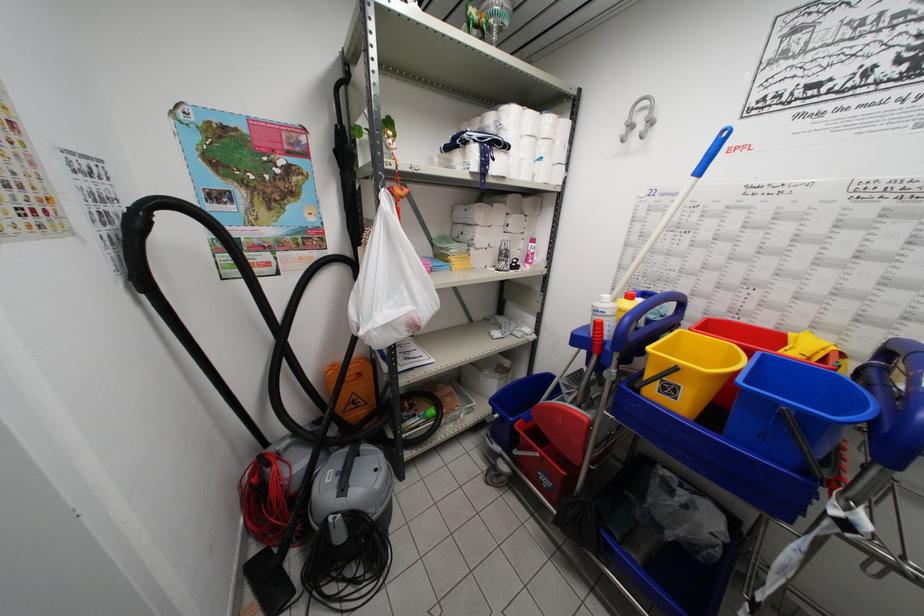
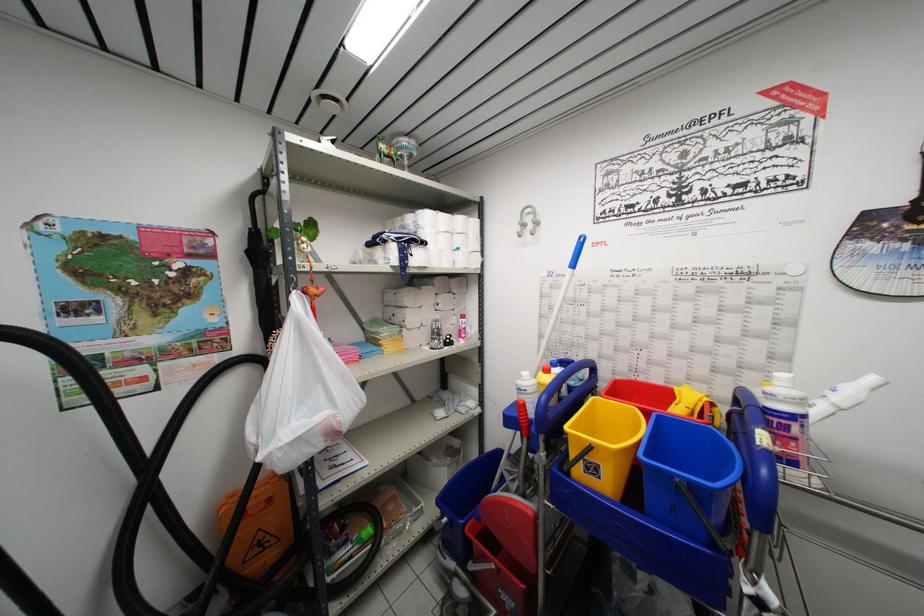
Where in the second image is the point corresponding to (x=780, y=407) from the first image?

(675, 479)